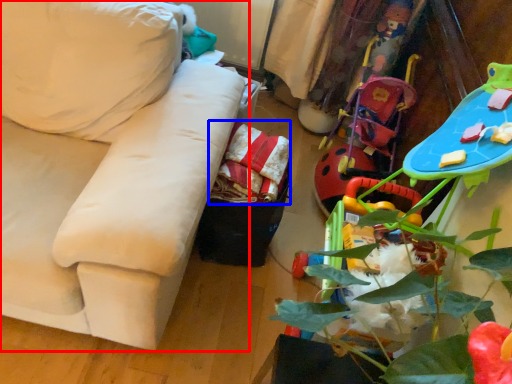
Question: Which of the following is the closest to the observer, studio couch (highlighted by a red box) or material (highlighted by a blue box)?

Choices:
 (A) studio couch
 (B) material

Answer: (A)